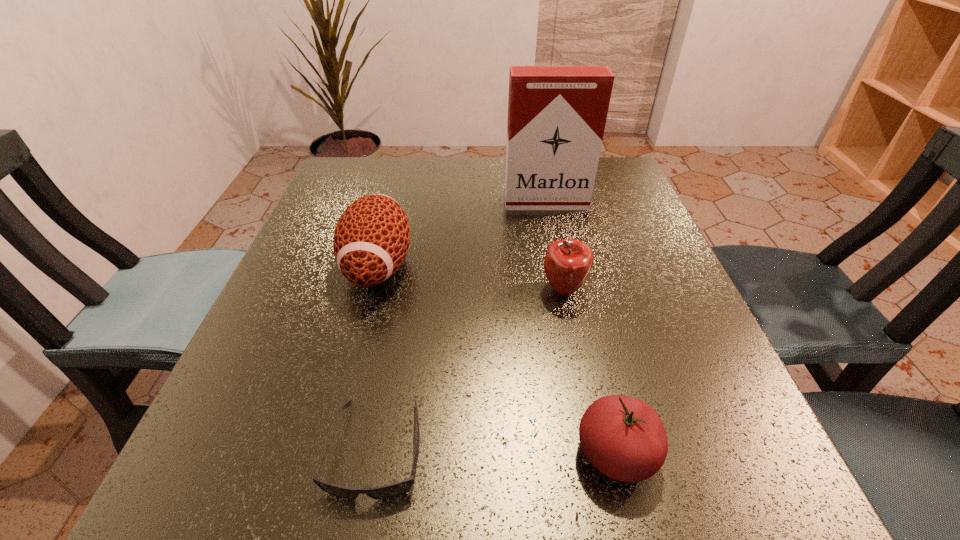
The image size is (960, 540). Find the location of `object that is at the far edge`. object that is at the far edge is located at coordinates (557, 115).

This screenshot has width=960, height=540. I want to click on tomato present at the near edge, so (624, 438).

Identify the location of sunglasses that is at the near edge. Image resolution: width=960 pixels, height=540 pixels. (399, 488).

I want to click on object that is at the left edge, so click(x=371, y=239).

The height and width of the screenshot is (540, 960). I want to click on cigarette_case that is at the right edge, so click(557, 115).

Where is `tomato at the right edge`? Image resolution: width=960 pixels, height=540 pixels. tomato at the right edge is located at coordinates (624, 438).

Where is `object situated at the far right corner`? Image resolution: width=960 pixels, height=540 pixels. object situated at the far right corner is located at coordinates (557, 115).

You are a GUI agent. You are given a task and a screenshot of the screen. Output one action in this format:
    pyautogui.click(x=<x>, y=<y>)
    Task: Click on the object that is at the near right corner
    The width and height of the screenshot is (960, 540).
    Given the screenshot: What is the action you would take?
    pyautogui.click(x=624, y=438)

Identify the location of vacant space at the far edge of the desktop. (494, 157).

Image resolution: width=960 pixels, height=540 pixels. I want to click on vacant area at the left edge, so click(324, 291).